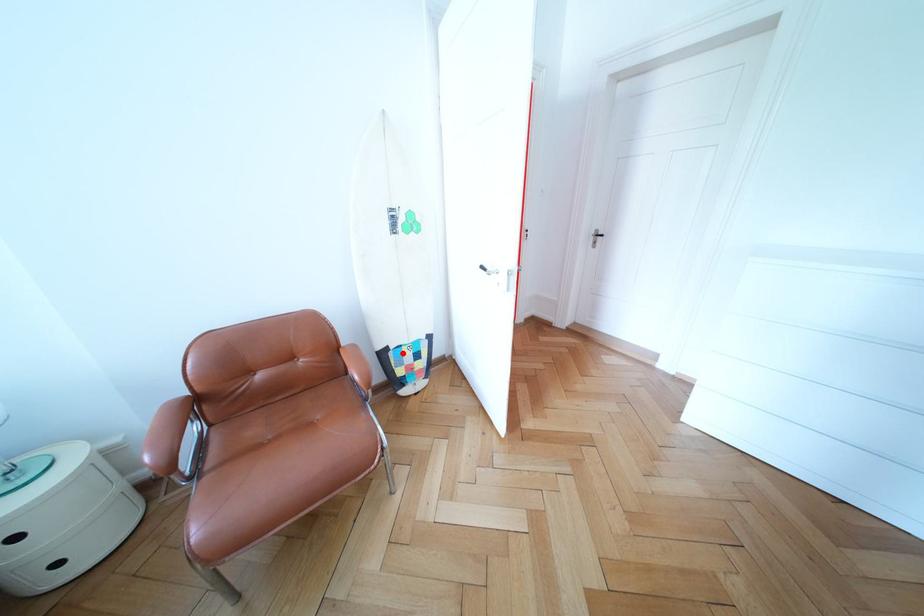
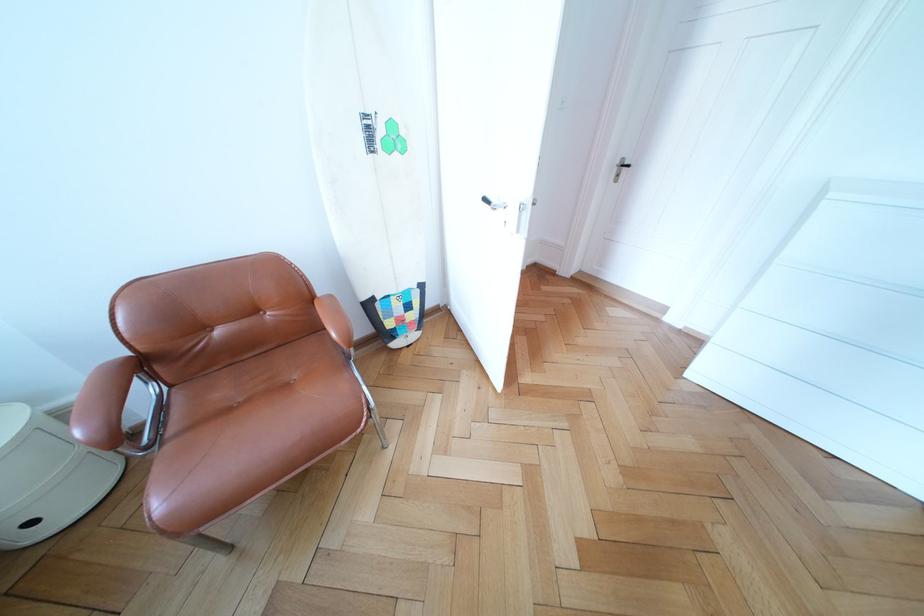
Question: I am providing you with two images of the same scene from different viewpoints. A red point is shown in image1. For the corresponding object point in image2, is it positioned nearer or farther from the camera?

Choices:
 (A) Nearer
 (B) Farther

Answer: (A)